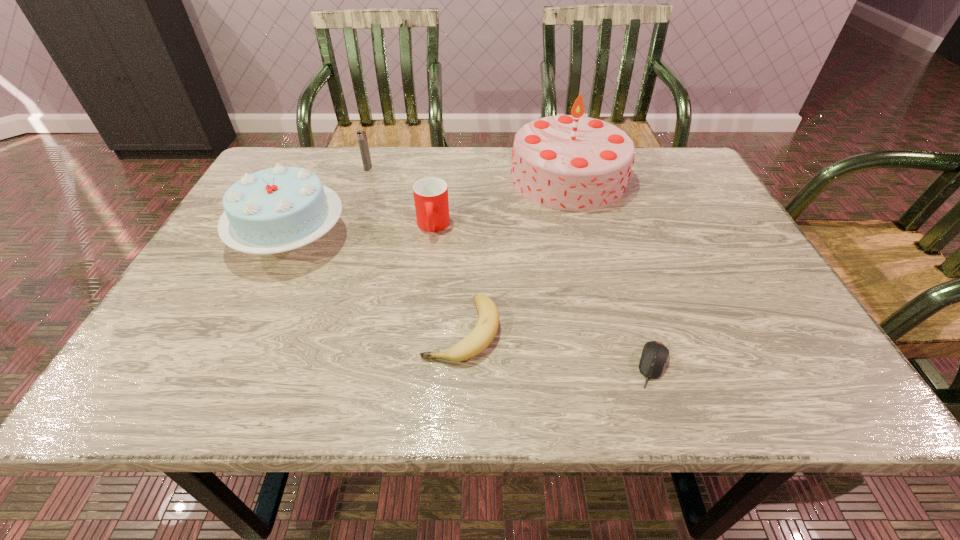
Identify the location of vacant area situated 0.100m on the front of the igniter. Image resolution: width=960 pixels, height=540 pixels. (361, 192).

Find the location of a particular element. vacant region located on the side of the cup with the handle is located at coordinates (428, 265).

Where is `free space located on the right of the banana`? free space located on the right of the banana is located at coordinates (651, 330).

Where is `free space located 0.200m on the right of the computer mouse`? The width and height of the screenshot is (960, 540). free space located 0.200m on the right of the computer mouse is located at coordinates (784, 365).

Identify the location of birthday cake at the far edge. The width and height of the screenshot is (960, 540). (571, 162).

You are a GUI agent. You are given a task and a screenshot of the screen. Output one action in this format:
    pyautogui.click(x=<x>, y=<y>)
    Task: Click on the igniter present at the far edge
    
    Given the screenshot: What is the action you would take?
    pyautogui.click(x=361, y=135)

Locate an element on the screen. The width and height of the screenshot is (960, 540). banana that is positioned at the near edge is located at coordinates (478, 340).

You are a GUI agent. You are given a task and a screenshot of the screen. Output one action in this format:
    pyautogui.click(x=<x>, y=<y>)
    Task: Click on the computer mouse present at the near edge
    The height and width of the screenshot is (540, 960).
    Given the screenshot: What is the action you would take?
    pyautogui.click(x=654, y=356)

Find the location of a particular element. This screenshot has width=960, height=540. object at the left edge is located at coordinates (279, 209).

Where is `free space at the far edge`? This screenshot has height=540, width=960. free space at the far edge is located at coordinates click(x=457, y=177).